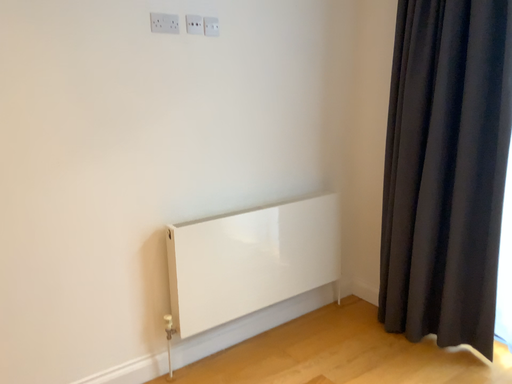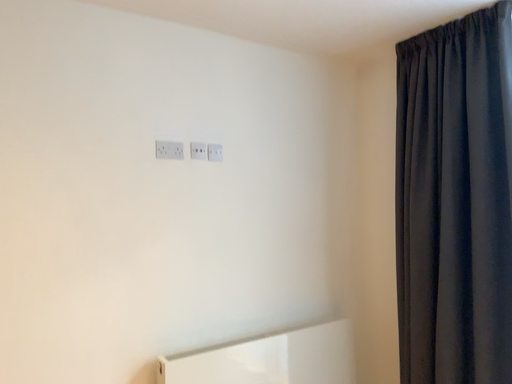
Question: How did the camera likely rotate when shooting the video?

Choices:
 (A) rotated upward
 (B) rotated downward

Answer: (A)